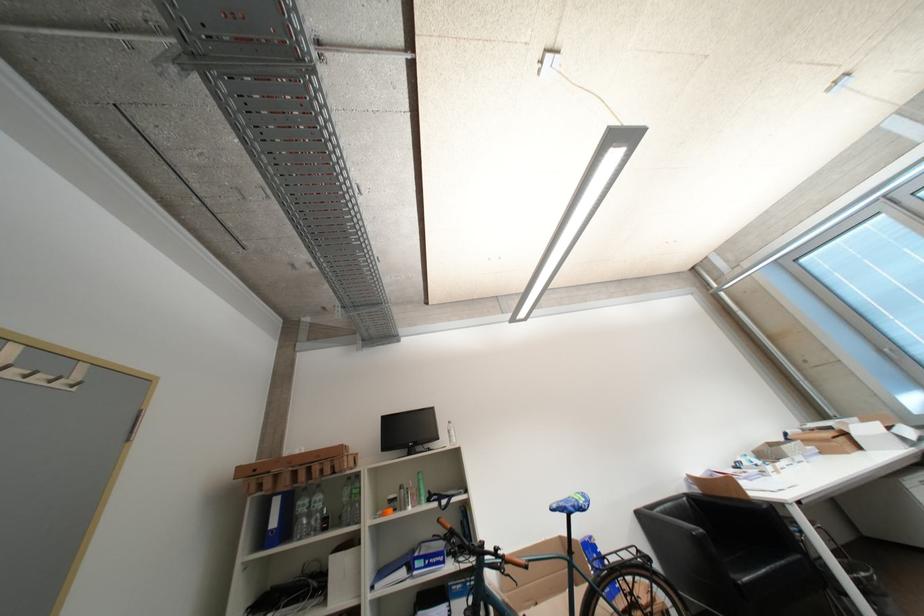
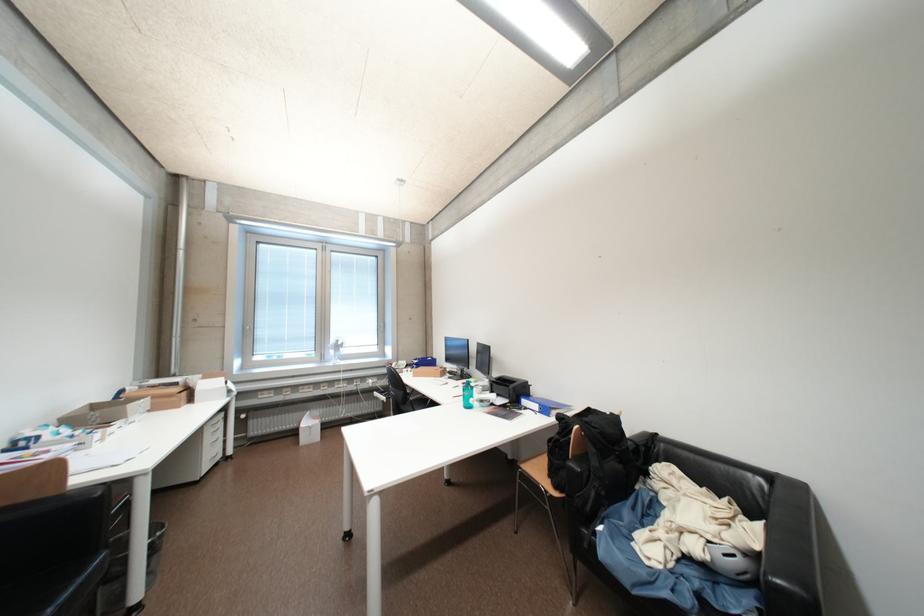
Where in the second image is the point corresponding to the point at 839,430 from the first image?

(184, 386)